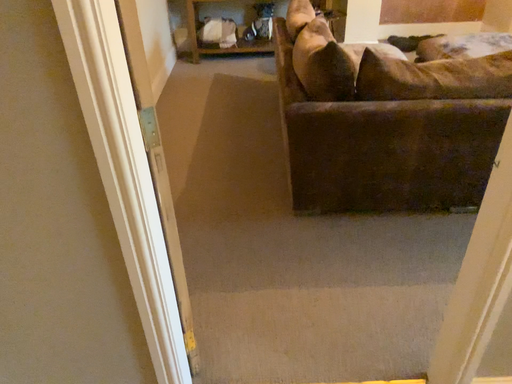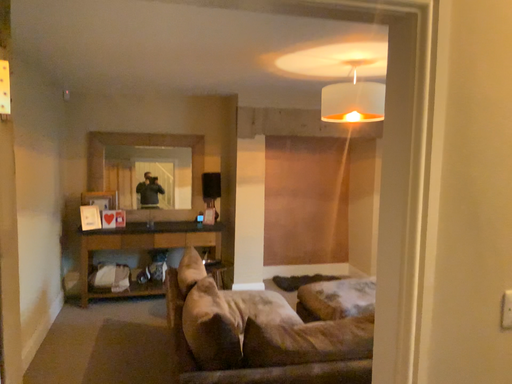
Question: How did the camera likely rotate when shooting the video?

Choices:
 (A) rotated left
 (B) rotated right

Answer: (B)